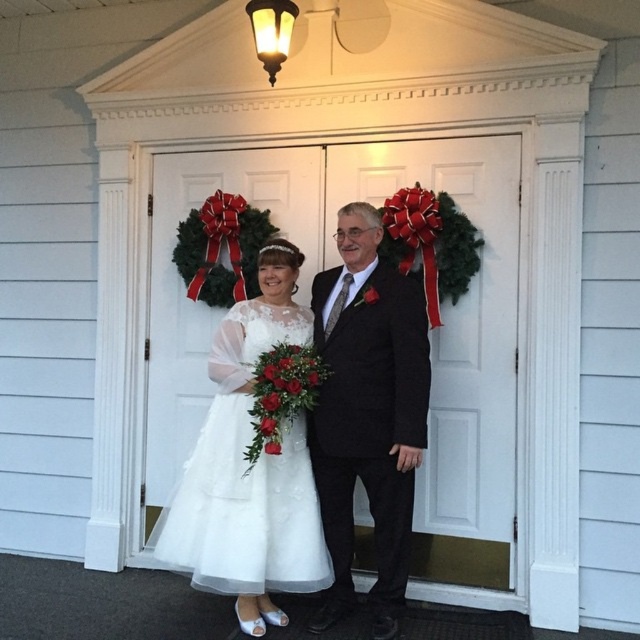
Question: Which of the following is the closest to the observer?

Choices:
 (A) black satin suit at center
 (B) white matte door at center
 (C) white satin bouquet at center
 (D) white lace dress at center

Answer: (C)

Question: Which point is closer to the camera?

Choices:
 (A) white satin bouquet at center
 (B) white matte door at center
 (C) black satin suit at center
 (D) white lace dress at center

Answer: (A)

Question: Can you confirm if white lace dress at center is wider than white satin bouquet at center?

Choices:
 (A) yes
 (B) no

Answer: (A)

Question: Can you confirm if white matte door at center is thinner than white satin bouquet at center?

Choices:
 (A) yes
 (B) no

Answer: (B)

Question: Which of the following is the farthest from the observer?

Choices:
 (A) (243, 301)
 (B) (353, 396)
 (C) (260, 435)
 (D) (499, 490)

Answer: (D)

Question: Can you confirm if white lace dress at center is positioned above white satin bouquet at center?

Choices:
 (A) no
 (B) yes

Answer: (A)